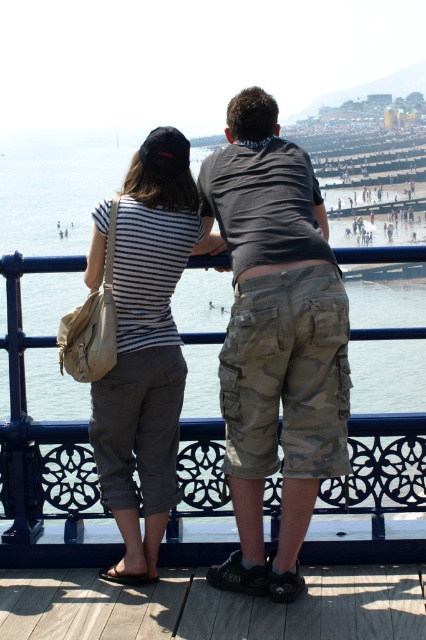
You are a fashion designer observing two people on a pier. You notice the camo shorts at center and the striped cotton shirt at center. Which clothing item appears bigger in size?

The camo shorts at center has a larger size compared to striped cotton shirt at center.

You are a photographer trying to capture a shot of the clear blue water at center without the camo shorts at center blocking the view. Based on their heights, is this possible?

The camo shorts at center is shorter than clear blue water at center, so the photographer can capture the clear blue water at center without obstruction from the camo shorts at center.

You are standing at the center of the pier and see the point marked at coordinates [275,339]. What object is located at that point?

The point at coordinates [275,339] marks the location of the camo shorts at center.